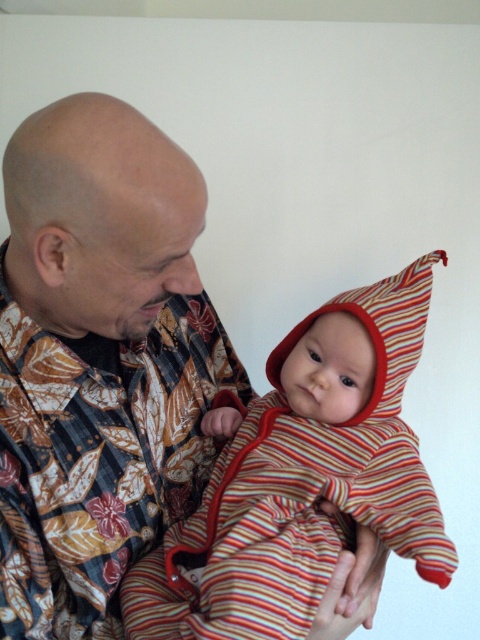
Question: Can you confirm if floral-patterned shirt at center is positioned above striped fabric baby at center?

Choices:
 (A) no
 (B) yes

Answer: (B)

Question: Which point is closer to the camera?

Choices:
 (A) floral-patterned shirt at center
 (B) striped fabric baby at center

Answer: (A)

Question: Which point is farther to the camera?

Choices:
 (A) (203, 627)
 (B) (55, 502)

Answer: (B)

Question: Does floral-patterned shirt at center have a lesser width compared to striped fabric baby at center?

Choices:
 (A) yes
 (B) no

Answer: (A)

Question: Is floral-patterned shirt at center bigger than striped fabric baby at center?

Choices:
 (A) no
 (B) yes

Answer: (B)